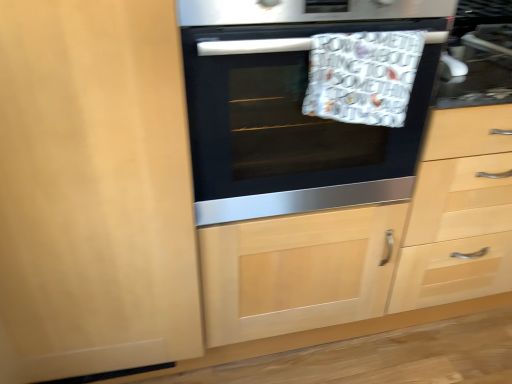
Locate an element on the screen. The image size is (512, 384). matte wood dresser at center is located at coordinates (373, 244).

Describe the element at coordinates (373, 244) in the screenshot. The image size is (512, 384). I see `matte wood dresser at center` at that location.

Describe the element at coordinates (292, 128) in the screenshot. I see `black glass oven at center` at that location.

Where is `black glass oven at center`? The height and width of the screenshot is (384, 512). black glass oven at center is located at coordinates (292, 128).

Where is `matte wood dresser at center`? matte wood dresser at center is located at coordinates tap(373, 244).

Would you say black glass oven at center is to the left or to the right of matte wood dresser at center in the picture?

In the image, black glass oven at center appears on the left side of matte wood dresser at center.

Is black glass oven at center in front of matte wood dresser at center?

Yes, black glass oven at center is in front of matte wood dresser at center.

Which is behind, point (259, 76) or point (451, 218)?

The point (451, 218) is farther.

From the image's perspective, is black glass oven at center located above or below matte wood dresser at center?

black glass oven at center is situated higher than matte wood dresser at center in the image.

From a real-world perspective, between black glass oven at center and matte wood dresser at center, who is vertically higher?

black glass oven at center, from a real-world perspective.

Is black glass oven at center thinner than matte wood dresser at center?

Incorrect, the width of black glass oven at center is not less than that of matte wood dresser at center.

Considering the sizes of objects black glass oven at center and matte wood dresser at center in the image provided, who is shorter, black glass oven at center or matte wood dresser at center?

black glass oven at center.

Considering the sizes of objects black glass oven at center and matte wood dresser at center in the image provided, who is smaller, black glass oven at center or matte wood dresser at center?

black glass oven at center.

Would you say black glass oven at center is inside or outside matte wood dresser at center?

black glass oven at center is spatially situated outside matte wood dresser at center.

Looking at this image, is black glass oven at center positioned far away from matte wood dresser at center?

No, black glass oven at center is not far from matte wood dresser at center.

Is black glass oven at center oriented away from matte wood dresser at center?

No.

Measure the distance between black glass oven at center and matte wood dresser at center.

A distance of 21.81 centimeters exists between black glass oven at center and matte wood dresser at center.

What are the coordinates of `dresser on the right of black glass oven at center` in the screenshot? It's located at (373, 244).

Between matte wood dresser at center and black glass oven at center, which one appears on the left side from the viewer's perspective?

From the viewer's perspective, black glass oven at center appears more on the left side.

Which is behind, matte wood dresser at center or black glass oven at center?

matte wood dresser at center.

Is point (391, 241) positioned after point (243, 158)?

Yes, point (391, 241) is behind point (243, 158).

From the image's perspective, who appears lower, matte wood dresser at center or black glass oven at center?

matte wood dresser at center is shown below in the image.

From a real-world perspective, is matte wood dresser at center positioned under black glass oven at center based on gravity?

Indeed, from a real-world perspective, matte wood dresser at center is positioned beneath black glass oven at center.

Which object is thinner, matte wood dresser at center or black glass oven at center?

matte wood dresser at center.

Between matte wood dresser at center and black glass oven at center, which one has less height?

black glass oven at center.

Based on their sizes in the image, would you say matte wood dresser at center is bigger or smaller than black glass oven at center?

Clearly, matte wood dresser at center is larger in size than black glass oven at center.

Is black glass oven at center a part of matte wood dresser at center?

That's incorrect, black glass oven at center is not inside matte wood dresser at center.

Is there a large distance between matte wood dresser at center and black glass oven at center?

Actually, matte wood dresser at center and black glass oven at center are a little close together.

From the picture: Is matte wood dresser at center turned away from black glass oven at center?

No, matte wood dresser at center is not facing the opposite direction of black glass oven at center.

How many degrees apart are the facing directions of matte wood dresser at center and black glass oven at center?

The facing directions of matte wood dresser at center and black glass oven at center are 2.59e-05 degrees apart.

How distant is matte wood dresser at center from black glass oven at center?

They are 8.59 inches apart.

In the image, there is a black glass oven at center. Identify the location of dresser below it (from a real-world perspective). (373, 244).

The image size is (512, 384). I want to click on dresser on the right of black glass oven at center, so click(x=373, y=244).

This screenshot has width=512, height=384. Identify the location of oven in front of the matte wood dresser at center. [292, 128].